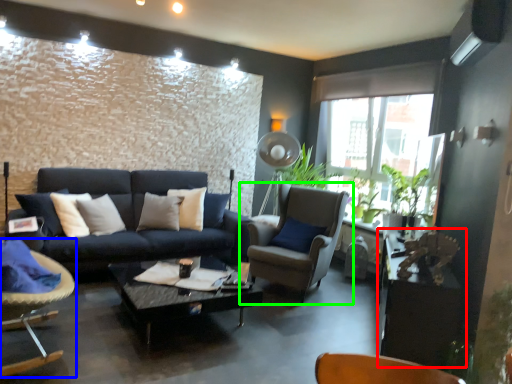
Question: Which object is positioned farthest from table (highlighted by a red box)? Select from chair (highlighted by a blue box) and chair (highlighted by a green box).

Choices:
 (A) chair
 (B) chair

Answer: (A)